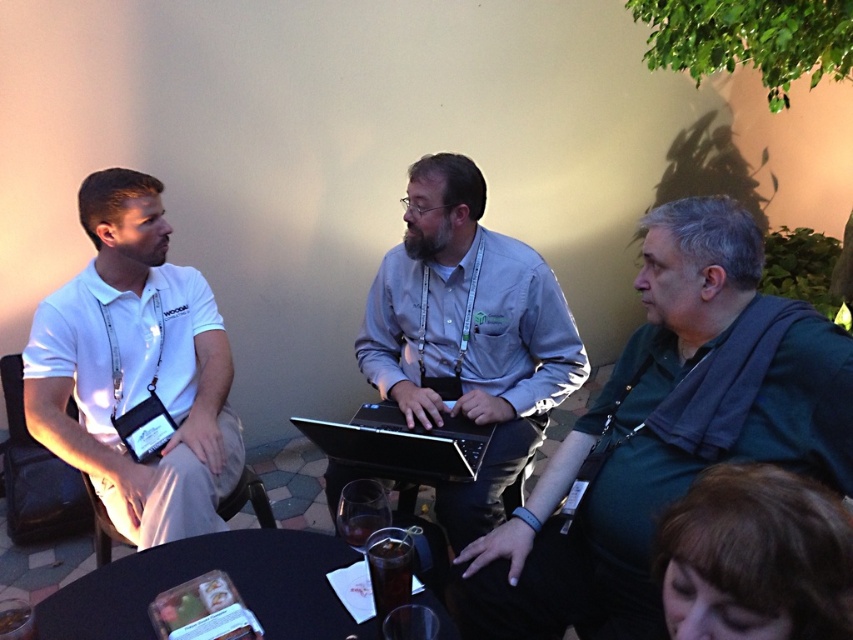
Does white matte polo shirt at left have a smaller size compared to black plastic table at lower center?

Incorrect, white matte polo shirt at left is not smaller in size than black plastic table at lower center.

Between point (97, 248) and point (187, 561), which one is positioned in front?

Point (187, 561) is more forward.

Who is more distant from viewer, (x=202, y=330) or (x=218, y=550)?

The point (x=202, y=330) is behind.

Identify the location of white matte polo shirt at left. Image resolution: width=853 pixels, height=640 pixels. (135, 369).

Which is in front, point (543, 268) or point (381, 412)?

Point (543, 268) is in front.

Which is more to the right, gray matte shirt at center or black matte laptop at center?

gray matte shirt at center is more to the right.

Is point (416, 284) positioned after point (369, 442)?

Yes, it is.

This screenshot has height=640, width=853. In order to click on gray matte shirt at center in this screenshot , I will do `click(468, 336)`.

Does dark green shirt at center appear under black plastic table at lower center?

Incorrect, dark green shirt at center is not positioned below black plastic table at lower center.

Is point (641, 289) less distant than point (38, 620)?

No, it is behind (38, 620).

The width and height of the screenshot is (853, 640). I want to click on dark green shirt at center, so click(665, 433).